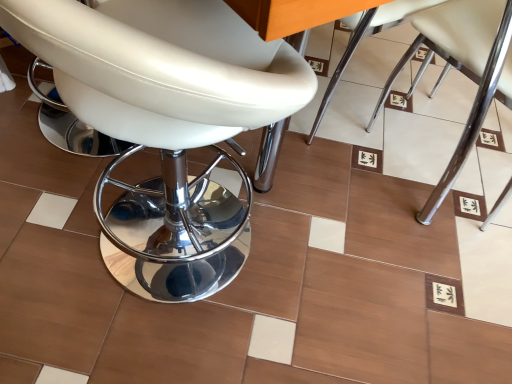
The image size is (512, 384). Identify the location of vacant area situated below white leather stool at left, which appears as the third chair when viewed from the right (from a real-world perspective). (150, 265).